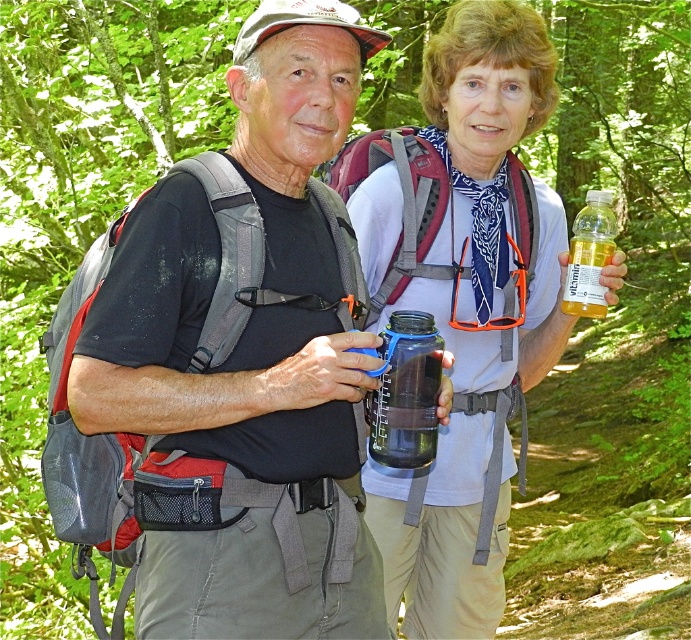
Describe the element at coordinates (406, 392) in the screenshot. I see `transparent plastic water bottle at center` at that location.

Image resolution: width=691 pixels, height=640 pixels. I want to click on transparent plastic water bottle at center, so coord(406,392).

Does point (388, 320) come behind point (612, 250)?

Yes, point (388, 320) is behind point (612, 250).

I want to click on transparent plastic water bottle at center, so click(x=406, y=392).